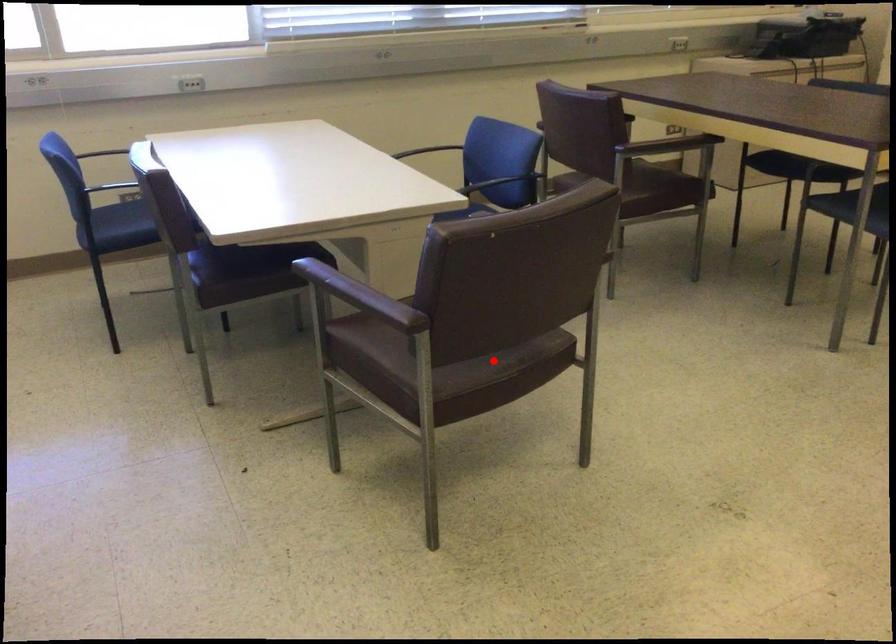
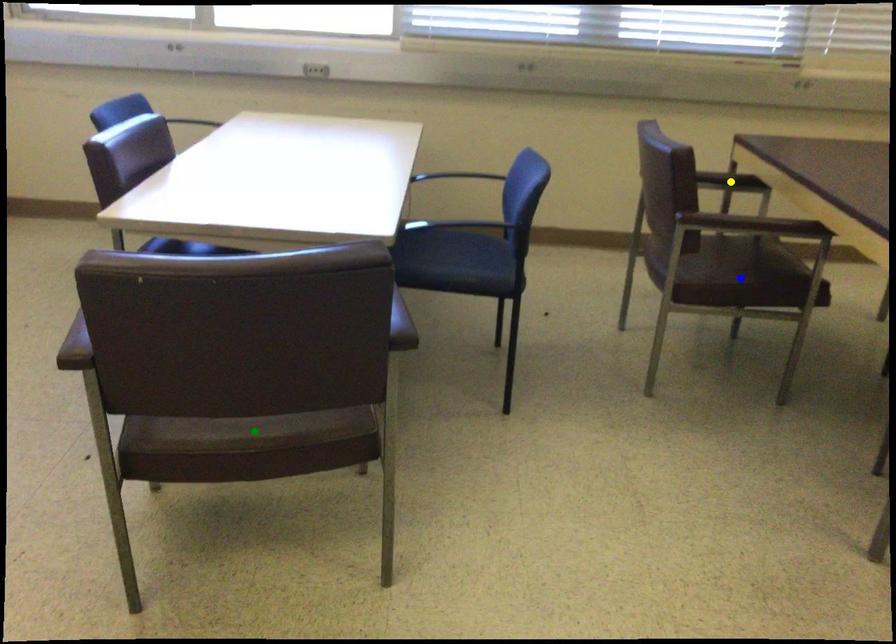
Question: I am providing you with two images of the same scene from different viewpoints. A red point is marked on the first image. You are given multiple points on the second image. Which mark in image 2 goes with the point in image 1?

Choices:
 (A) blue point
 (B) yellow point
 (C) green point

Answer: (C)